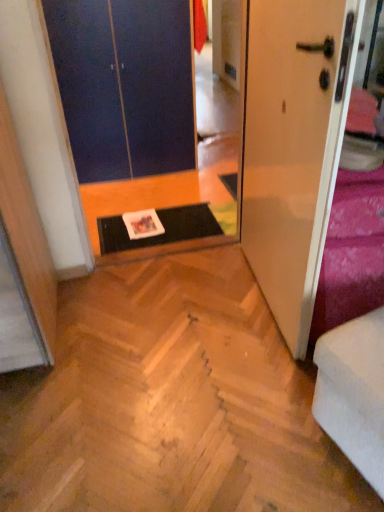
This screenshot has width=384, height=512. Find the location of `free location above natural wood parquet floor at center (from a real-world perspective)`. free location above natural wood parquet floor at center (from a real-world perspective) is located at coordinates (182, 346).